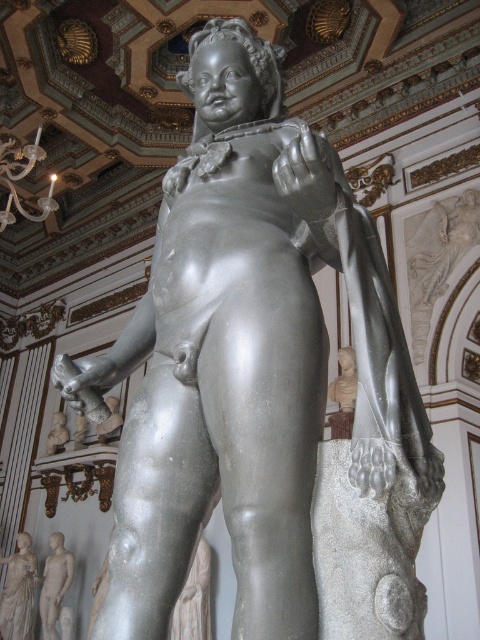
Question: Which point appears farthest from the camera in this image?

Choices:
 (A) (31, 540)
 (B) (44, 586)

Answer: (A)

Question: Among these points, which one is farthest from the camera?

Choices:
 (A) (26, 600)
 (B) (45, 604)

Answer: (A)

Question: Where is smooth white statue at lower left located in relation to gray marble statue at lower left in the image?

Choices:
 (A) left
 (B) right

Answer: (A)

Question: Is the position of smooth white statue at lower left less distant than that of gray marble statue at lower left?

Choices:
 (A) yes
 (B) no

Answer: (B)

Question: Does smooth white statue at lower left have a smaller size compared to gray marble statue at lower left?

Choices:
 (A) yes
 (B) no

Answer: (A)